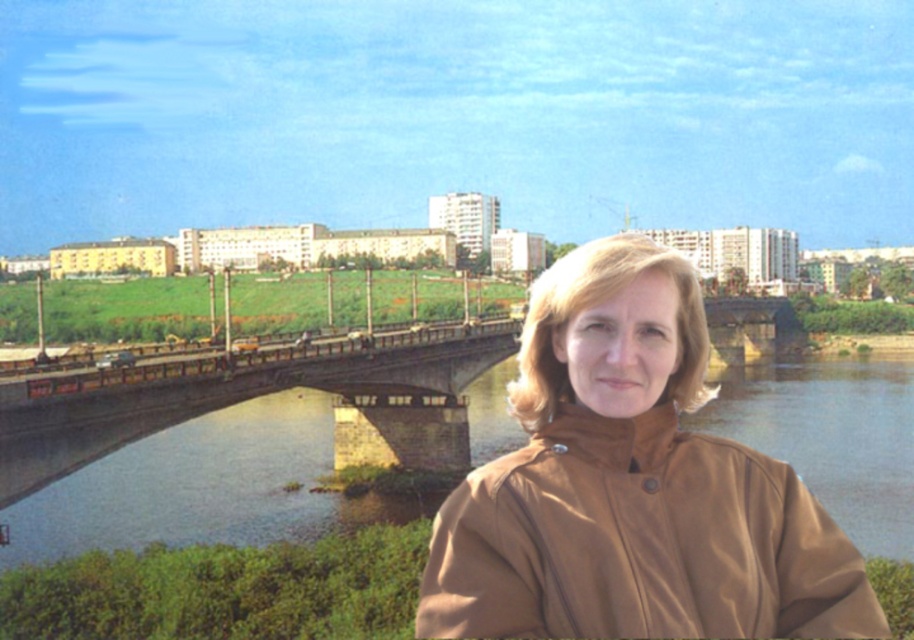
Who is higher up, brown matte trench coat at lower right or brown stone bridge at center?

brown matte trench coat at lower right

Is point (535, 483) behind point (804, 419)?

That is False.

You are a GUI agent. You are given a task and a screenshot of the screen. Output one action in this format:
    pyautogui.click(x=<x>, y=<y>)
    Task: Click on the brown matte trench coat at lower right
    This screenshot has width=914, height=640.
    Given the screenshot: What is the action you would take?
    pyautogui.click(x=639, y=541)